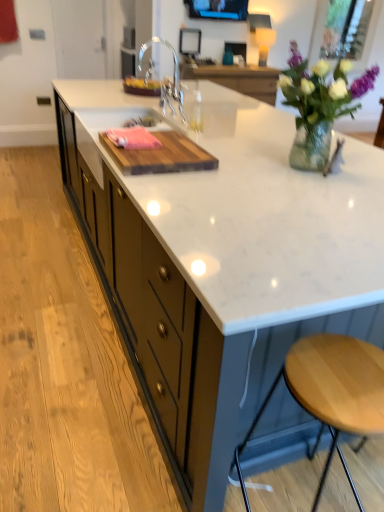
You are a GUI agent. You are given a task and a screenshot of the screen. Output one action in this format:
    pyautogui.click(x=<x>, y=<y>)
    Task: Click on the blank space situated above white marble countertop at center (from a real-world perspective)
    This screenshot has height=512, width=384.
    Given the screenshot: What is the action you would take?
    pyautogui.click(x=263, y=164)